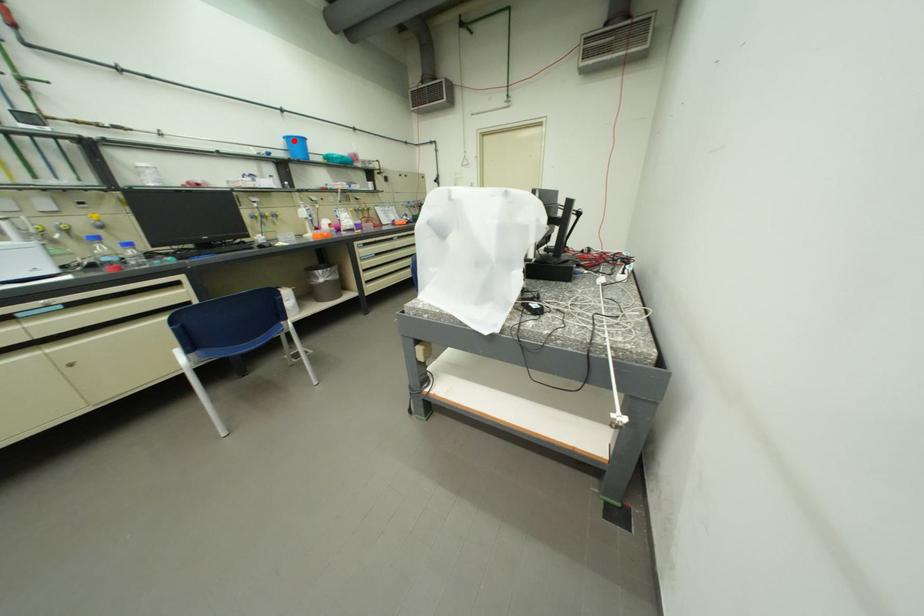
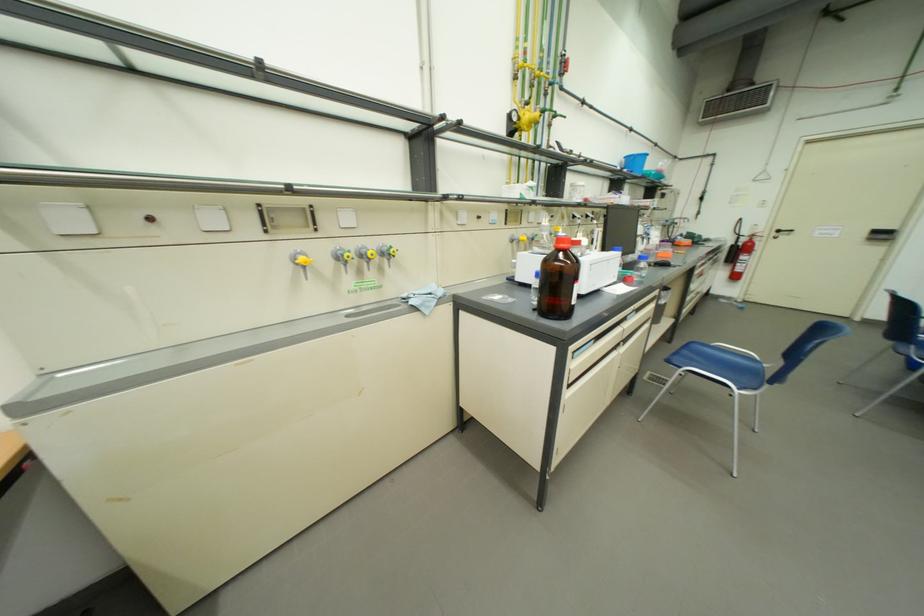
Find the pixel in the second image that matches the highlighted location in the first image.

(634, 159)